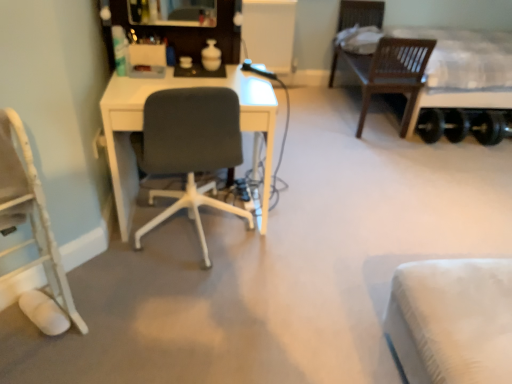
Where is `vacant space that is in between matte gray chair at center, which is the 1th chair from right to left, and white fabric chair at lower left, positioned as the 1th chair in left-to-right order`? This screenshot has height=384, width=512. vacant space that is in between matte gray chair at center, which is the 1th chair from right to left, and white fabric chair at lower left, positioned as the 1th chair in left-to-right order is located at coordinates (134, 294).